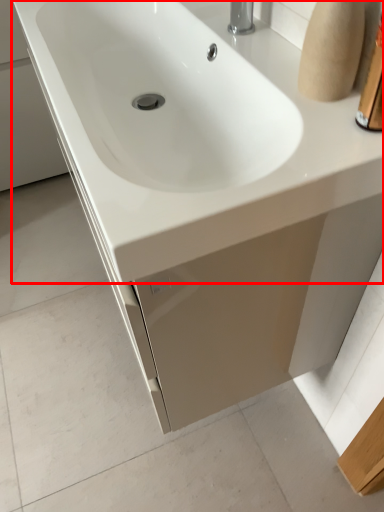
Question: Observing the image, what is the correct spatial positioning of sink (annotated by the red box) in reference to toiletry?

Choices:
 (A) left
 (B) right

Answer: (A)